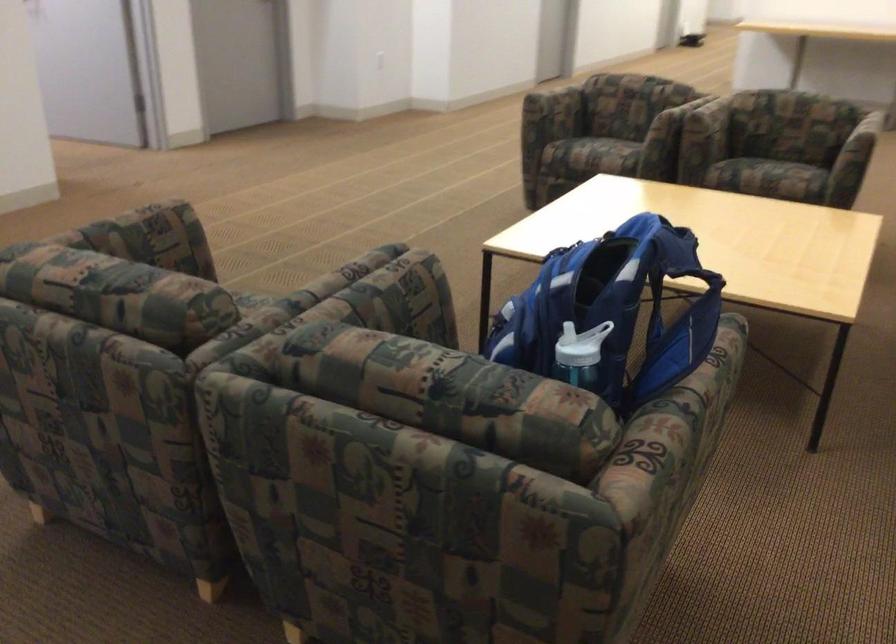
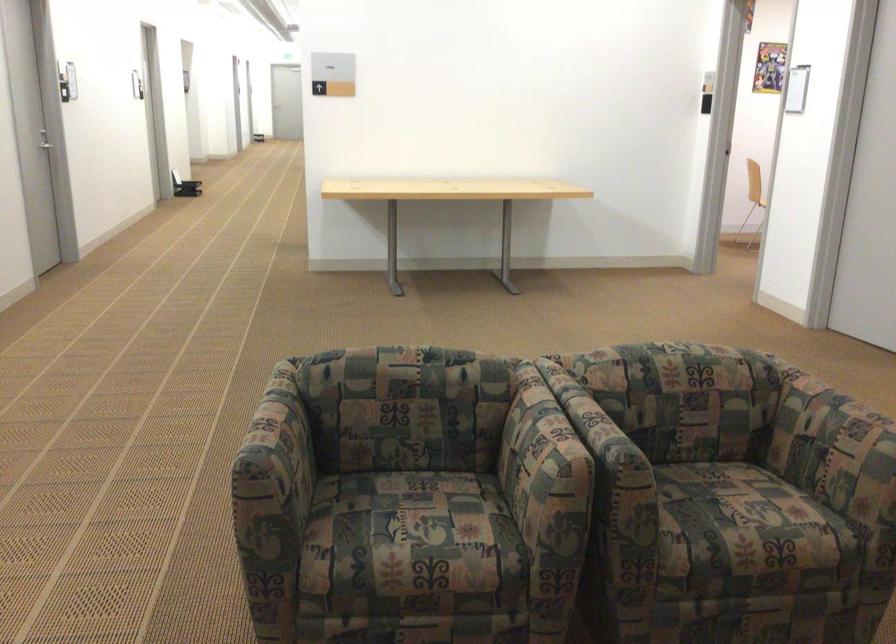
Where in the second image is the point corresponding to point 748,149 from the first image?

(707, 505)